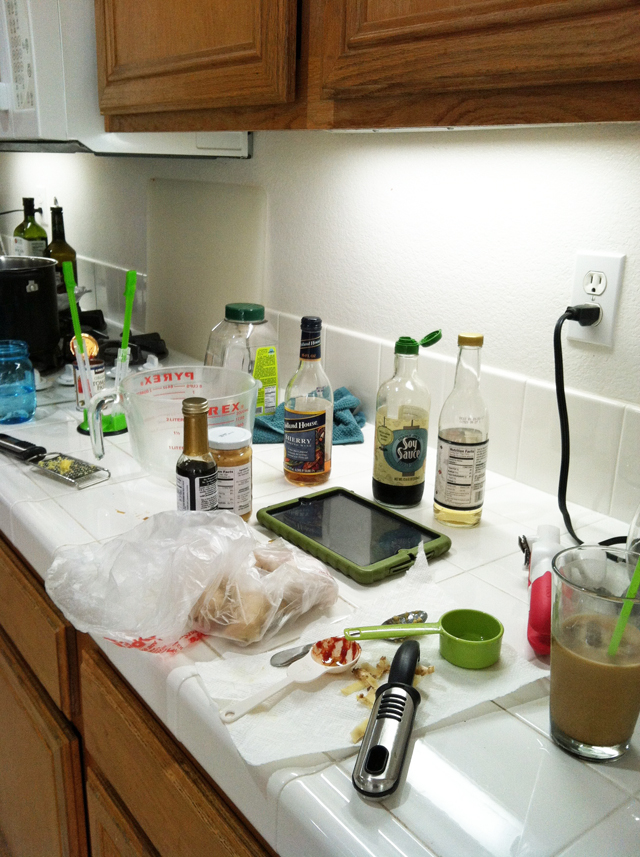
Locate an element on the screen. clear glass is located at coordinates (605, 718).